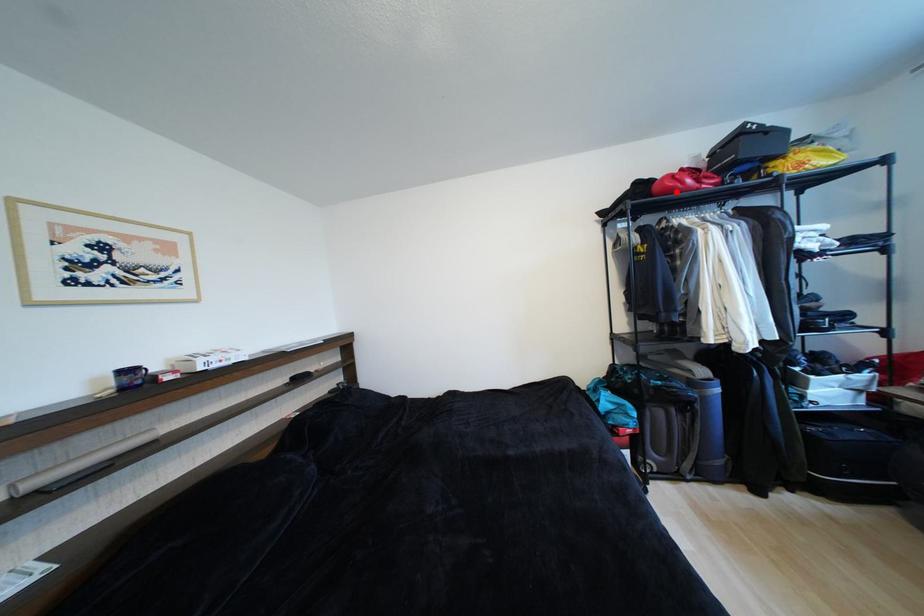
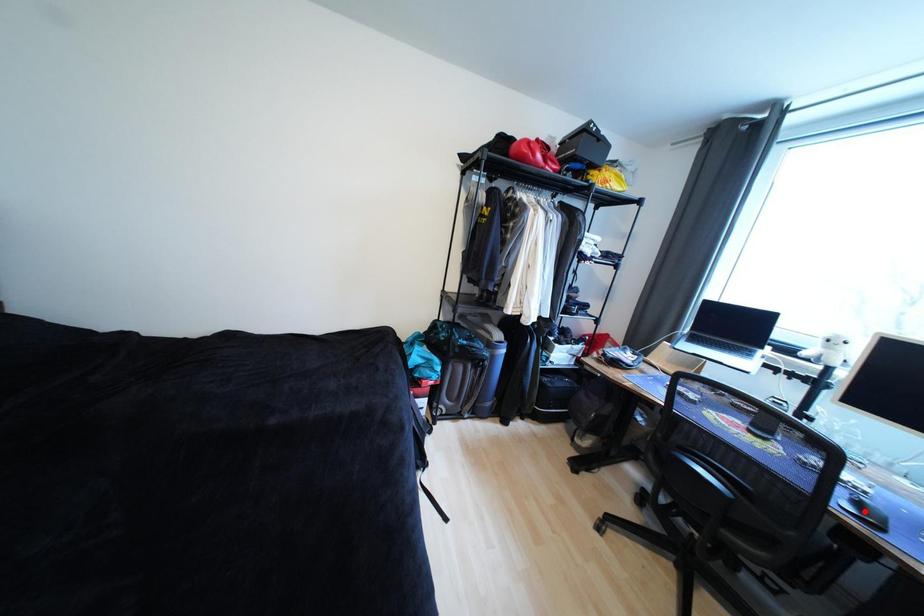
I am providing you with two images of the same scene from different viewpoints. A red point is marked on the first image and another point is marked on the second image. Does the point marked in image1 correspond to the same location as the one in image2?

No